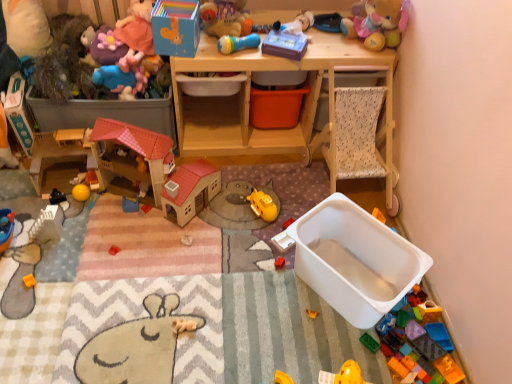
This screenshot has height=384, width=512. Identify the location of free spot in front of white plastic toy at center, arranged as the tenth toy when viewed from the left. (276, 281).